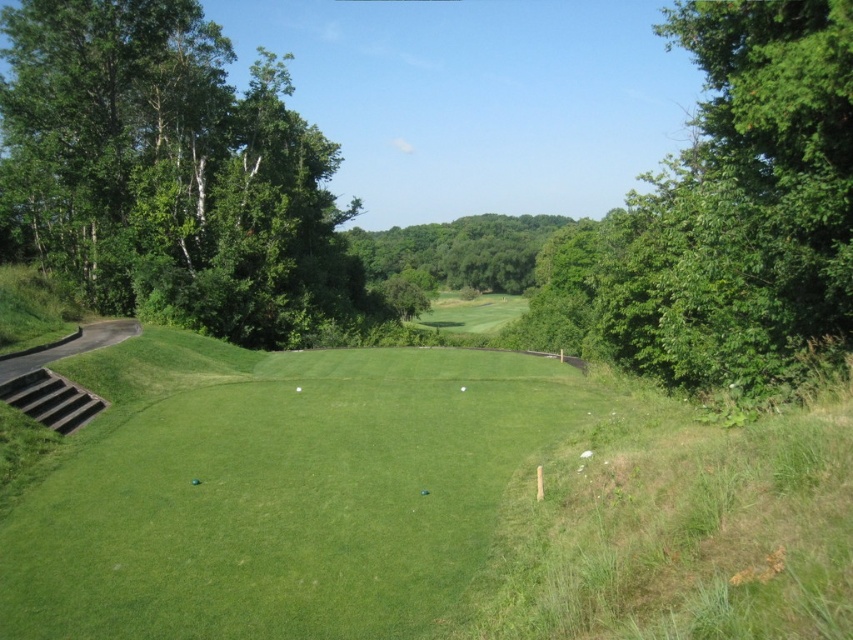
Question: Considering the relative positions of green leafy tree at left and green leafy tree at upper right in the image provided, where is green leafy tree at left located with respect to green leafy tree at upper right?

Choices:
 (A) below
 (B) above

Answer: (A)

Question: Does green grassy golf course at center have a smaller size compared to green smooth golf ball at center?

Choices:
 (A) yes
 (B) no

Answer: (B)

Question: Can you confirm if green grassy golf course at center is positioned above green leafy tree at left?

Choices:
 (A) no
 (B) yes

Answer: (A)

Question: Considering the real-world distances, which object is closest to the green smooth golf ball at center?

Choices:
 (A) green matte golf ball at center
 (B) green leafy trees at center
 (C) green grassy golf course at center
 (D) green leafy tree at left

Answer: (A)

Question: Among these objects, which one is nearest to the camera?

Choices:
 (A) green leafy tree at upper right
 (B) green leafy tree at left

Answer: (A)

Question: Which object is the closest to the green leafy tree at left?

Choices:
 (A) green leafy tree at upper right
 (B) green smooth golf ball at center

Answer: (A)